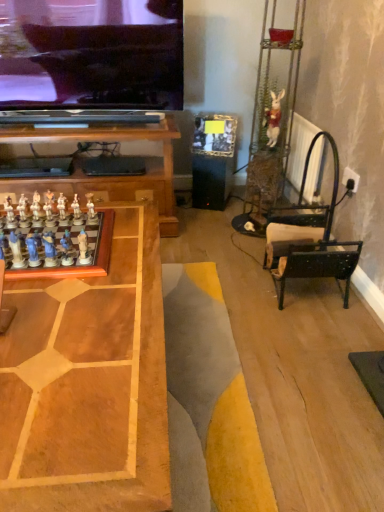
Question: Is white glossy chess piece at left, which is the 6th toy in front-to-back order, bigger than white glossy chess piece at left, placed as the seventh toy when sorted from front to back?

Choices:
 (A) no
 (B) yes

Answer: (B)

Question: Is white glossy chess piece at left, the 11th toy when ordered from right to left, not near white glossy chess piece at left, which is the second toy from left to right?

Choices:
 (A) no
 (B) yes

Answer: (A)

Question: Could you tell me if white glossy chess piece at left, the 11th toy when ordered from right to left, is turned towards white glossy chess piece at left, which is the second toy from left to right?

Choices:
 (A) no
 (B) yes

Answer: (A)

Question: Can you see white glossy chess piece at left, which ranks as the 6th toy in back-to-front order, touching white glossy chess piece at left, marked as the 10th toy in a right-to-left arrangement?

Choices:
 (A) no
 (B) yes

Answer: (B)

Question: From a real-world perspective, is white glossy chess piece at left, the 11th toy when ordered from right to left, located beneath white glossy chess piece at left, placed as the seventh toy when sorted from front to back?

Choices:
 (A) yes
 (B) no

Answer: (A)

Question: Considering the relative positions of white glossy chess piece at left, which ranks as the 6th toy in back-to-front order, and white glossy chess piece at left, which is the second toy from left to right, in the image provided, is white glossy chess piece at left, which ranks as the 6th toy in back-to-front order, to the right of white glossy chess piece at left, which is the second toy from left to right, from the viewer's perspective?

Choices:
 (A) no
 (B) yes

Answer: (A)

Question: Is white fabric rabbit at upper right, which is counted as the first toy, starting from the right, not within matte blue chess piece at left, the eighth toy in the right-to-left sequence?

Choices:
 (A) no
 (B) yes

Answer: (B)

Question: Does white fabric rabbit at upper right, which is the 1th toy from back to front, have a greater width compared to matte blue chess piece at left, the 4th toy viewed from the left?

Choices:
 (A) no
 (B) yes

Answer: (B)

Question: Is white fabric rabbit at upper right, which is counted as the first toy, starting from the right, positioned in front of matte blue chess piece at left, the eighth toy in the right-to-left sequence?

Choices:
 (A) no
 (B) yes

Answer: (A)

Question: From the image's perspective, is white fabric rabbit at upper right, acting as the eleventh toy starting from the front, beneath matte blue chess piece at left, the eighth toy in the right-to-left sequence?

Choices:
 (A) yes
 (B) no

Answer: (B)

Question: Does white fabric rabbit at upper right, acting as the eleventh toy starting from the front, have a lesser height compared to matte blue chess piece at left, the eighth toy in the right-to-left sequence?

Choices:
 (A) yes
 (B) no

Answer: (B)

Question: Does white fabric rabbit at upper right, which is counted as the first toy, starting from the right, lie behind matte blue chess piece at left, acting as the 9th toy starting from the back?

Choices:
 (A) yes
 (B) no

Answer: (A)

Question: Is matte blue chess pieces at left, the third toy when ordered from left to right, at the back of white glossy chess piece at center-left, which is the 3th toy from right to left?

Choices:
 (A) yes
 (B) no

Answer: (B)